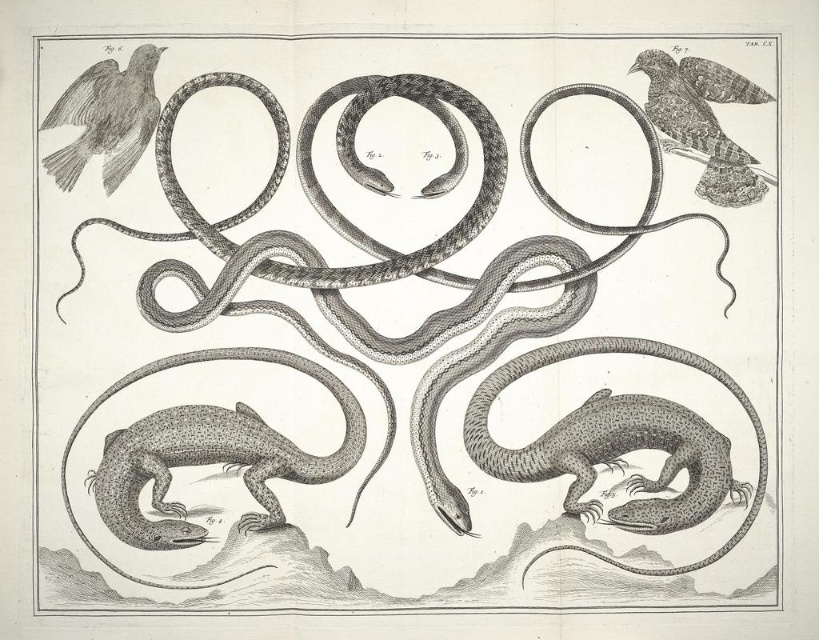
Question: Among these objects, which one is nearest to the camera?

Choices:
 (A) smooth gray bird at upper left
 (B) speckled textured lizard at center

Answer: (B)

Question: Does speckled gray lizard at center appear under smooth gray bird at upper left?

Choices:
 (A) no
 (B) yes

Answer: (B)

Question: Does speckled gray lizard at center appear under speckled textured lizard at lower left?

Choices:
 (A) yes
 (B) no

Answer: (B)

Question: Which of the following is the closest to the observer?

Choices:
 (A) smooth gray bird at upper left
 (B) smooth feathered bird at upper right
 (C) speckled textured lizard at lower left

Answer: (C)

Question: Which object is farther from the camera taking this photo?

Choices:
 (A) speckled textured lizard at lower left
 (B) smooth feathered bird at upper right
 (C) speckled gray lizard at center
 (D) smooth gray bird at upper left

Answer: (B)

Question: Does speckled gray lizard at center appear on the right side of speckled textured lizard at center?

Choices:
 (A) no
 (B) yes

Answer: (A)